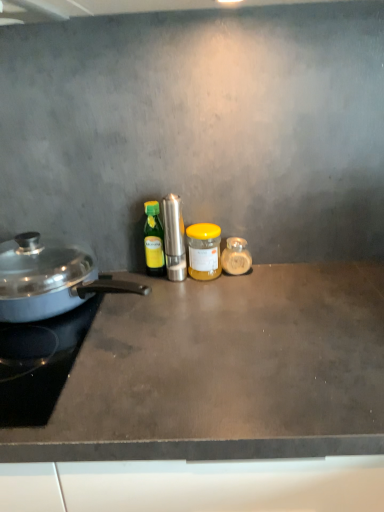
Identify the location of free space on the front side of polished stainless steel grinder at center, which ranks as the 3th kitchen appliance in right-to-left order. (176, 313).